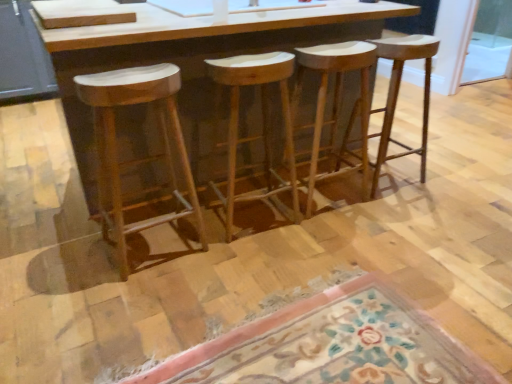
Where is `vacant region under natural wood stool at left, which is counted as the fourth stool, starting from the right (from a real-world perspective)`? This screenshot has height=384, width=512. vacant region under natural wood stool at left, which is counted as the fourth stool, starting from the right (from a real-world perspective) is located at coordinates (157, 246).